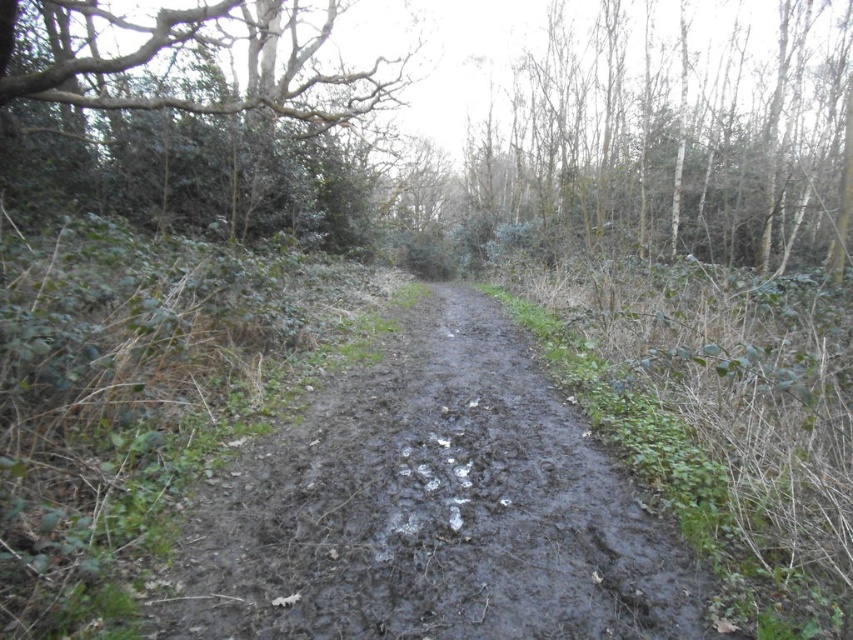
Can you confirm if muddy/damp dirt track at center is wider than green leafy tree at upper left?

Indeed, muddy/damp dirt track at center has a greater width compared to green leafy tree at upper left.

Which is more to the right, muddy/damp dirt track at center or green leafy tree at upper left?

muddy/damp dirt track at center is more to the right.

At what (x,y) coordinates should I click in order to perform the action: click on muddy/damp dirt track at center. Please return your answer as a coordinate pair (x, y). This screenshot has width=853, height=640. Looking at the image, I should click on (431, 509).

Can you confirm if bare branches at upper right is positioned to the right of green leafy tree at upper left?

Correct, you'll find bare branches at upper right to the right of green leafy tree at upper left.

Is point (531, 186) closer to camera compared to point (32, 29)?

No, it is behind (32, 29).

Between point (769, 188) and point (67, 68), which one is positioned behind?

The point (769, 188) is behind.

Identify the location of bare branches at upper right. (672, 147).

Between muddy/damp dirt track at center and bare branches at upper right, which one has more height?

muddy/damp dirt track at center is taller.

Is point (540, 481) behind point (543, 221)?

No.

Is point (300, 573) positioned behind point (741, 220)?

That is False.

Locate an element on the screen. Image resolution: width=853 pixels, height=640 pixels. muddy/damp dirt track at center is located at coordinates (431, 509).